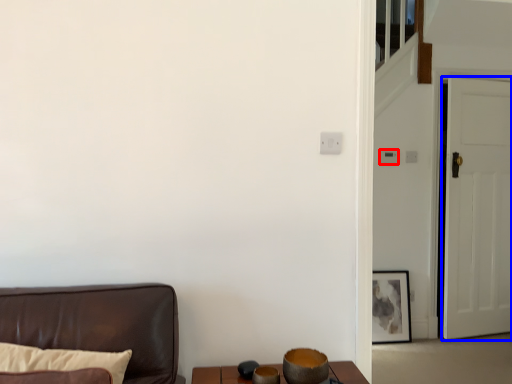
Question: Which object appears closest to the camera in this image, light switch (highlighted by a red box) or door (highlighted by a blue box)?

Choices:
 (A) light switch
 (B) door

Answer: (B)